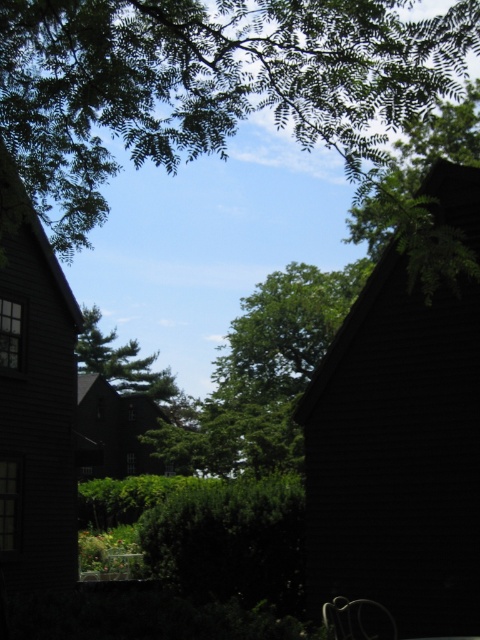
You are standing in the serene outdoor scene and want to take a photo of both the green leafy tree at upper center and the green matte tree at center. To ensure both are fully visible in your photo, which tree should you position closer to the edge of the frame?

You should position the green leafy tree at upper center closer to the right edge of the frame since it is already to the right of the green matte tree at center.

Based on the photo, you are an architect designing a new garden and want to place a bench in the scene. The bench must be placed at coordinates exactly 0.05 units to the right and 0.03 units below the green leafy tree at upper center. Where should you place the bench in relation to the tree?

The bench should be placed 0.05 units to the right and 0.03 units below the green leafy tree at upper center, which would position it at coordinates approximately at point [217,116] relative to the tree.

You are standing in the serene outdoor scene shown. You notice a point marked at coordinates (203, 84). Which object does this point correspond to?

The point at (203, 84) corresponds to the green leafy tree at upper center.